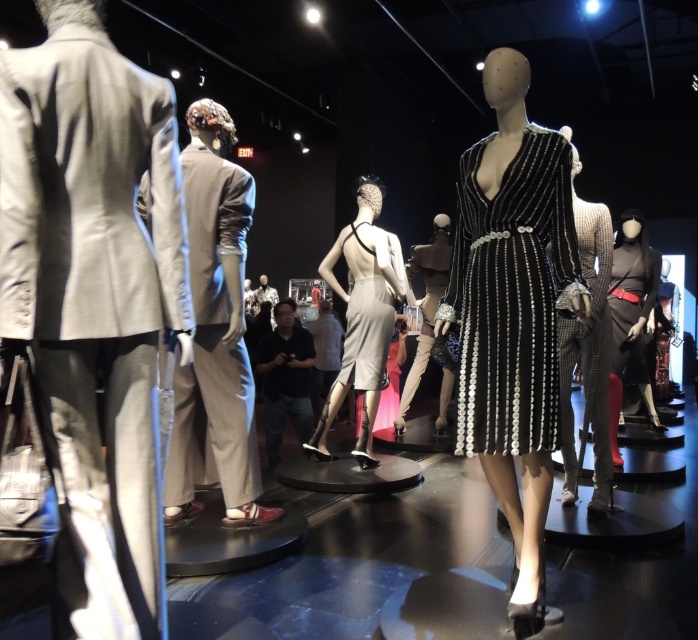
Question: Which object is positioned closest to the matte gray suit at left?

Choices:
 (A) satin beige dress at center
 (B) satin grey dress at center
 (C) matte black dress at right

Answer: (A)

Question: Is matte gray suit at left to the right of light gray fabric suit at left from the viewer's perspective?

Choices:
 (A) yes
 (B) no

Answer: (A)

Question: Which point is farther to the camera?

Choices:
 (A) satin beige dress at center
 (B) satin silver clutch at center
 (C) light gray fabric suit at left

Answer: (B)

Question: Does satin grey dress at center have a smaller size compared to satin silver clutch at center?

Choices:
 (A) no
 (B) yes

Answer: (B)

Question: Which point is farther to the camera?

Choices:
 (A) (111, 240)
 (B) (211, 336)

Answer: (B)

Question: Does black sequined dress at center have a smaller size compared to light gray fabric suit at left?

Choices:
 (A) no
 (B) yes

Answer: (B)